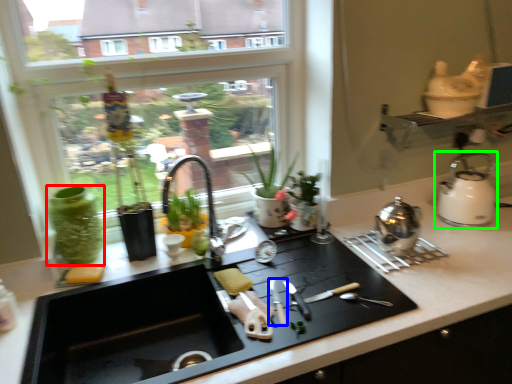
Question: Which object is positioned farthest from glass vase (highlighted by a red box)? Select from knife (highlighted by a blue box) and kitchen appliance (highlighted by a green box).

Choices:
 (A) knife
 (B) kitchen appliance

Answer: (B)